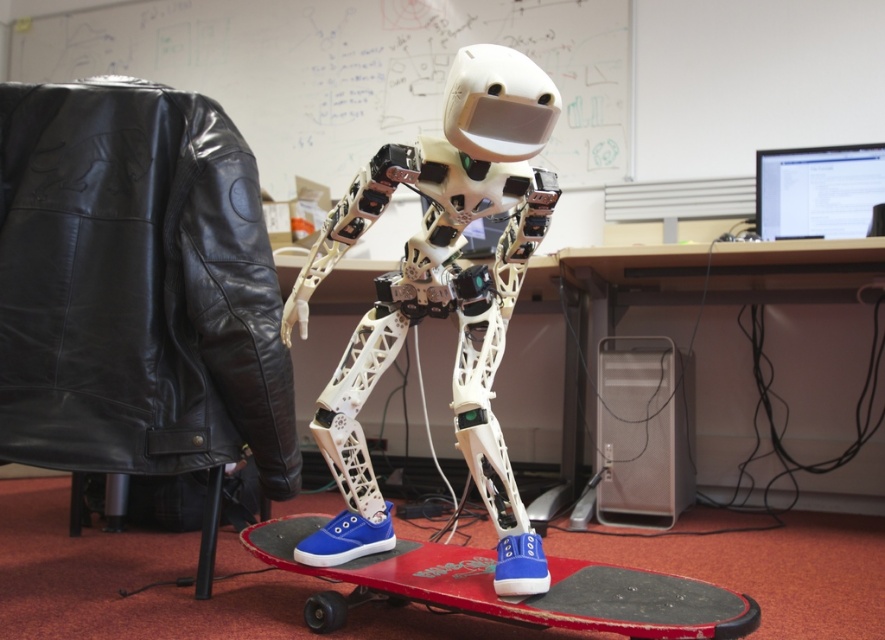
Question: From the image, what is the correct spatial relationship of black leather jacket at left in relation to white matte robot at center?

Choices:
 (A) right
 (B) left

Answer: (B)

Question: Is black leather jacket at left closer to the viewer compared to red plastic skateboard at center?

Choices:
 (A) yes
 (B) no

Answer: (B)

Question: Considering the real-world distances, which object is farthest from the red plastic skateboard at center?

Choices:
 (A) white matte robot at center
 (B) black leather jacket at left

Answer: (B)

Question: Which point appears farthest from the camera in this image?

Choices:
 (A) click(495, 497)
 (B) click(82, 380)

Answer: (B)

Question: Estimate the real-world distances between objects in this image. Which object is farther from the black leather jacket at left?

Choices:
 (A) red plastic skateboard at center
 (B) white matte robot at center

Answer: (A)

Question: Is black leather jacket at left above red plastic skateboard at center?

Choices:
 (A) no
 (B) yes

Answer: (B)